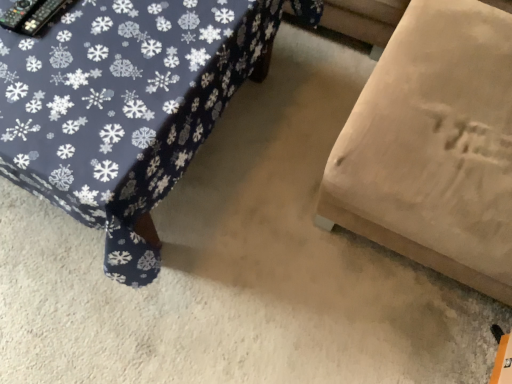
Question: In terms of width, does beige fabric couch at lower right, the first furniture when ordered from left to right, look wider or thinner when compared to beige fabric ottoman at lower right, the 1th furniture viewed from the right?

Choices:
 (A) thin
 (B) wide

Answer: (B)

Question: From the image's perspective, is beige fabric couch at lower right, arranged as the second furniture when viewed from the right, positioned above or below beige fabric ottoman at lower right, which is the second furniture from left to right?

Choices:
 (A) below
 (B) above

Answer: (A)

Question: Considering the positions of point (152, 112) and point (354, 135), is point (152, 112) closer or farther from the camera than point (354, 135)?

Choices:
 (A) closer
 (B) farther

Answer: (A)

Question: In the image, is beige fabric ottoman at lower right, which is the second furniture from left to right, positioned in front of or behind beige fabric couch at lower right, arranged as the second furniture when viewed from the right?

Choices:
 (A) behind
 (B) front

Answer: (B)

Question: In terms of height, does beige fabric ottoman at lower right, which is the second furniture from left to right, look taller or shorter compared to beige fabric couch at lower right, arranged as the second furniture when viewed from the right?

Choices:
 (A) short
 (B) tall

Answer: (B)

Question: From the image's perspective, is beige fabric ottoman at lower right, which is the second furniture from left to right, positioned above or below beige fabric couch at lower right, arranged as the second furniture when viewed from the right?

Choices:
 (A) above
 (B) below

Answer: (A)

Question: Does point (468, 57) appear closer or farther from the camera than point (59, 61)?

Choices:
 (A) closer
 (B) farther

Answer: (B)